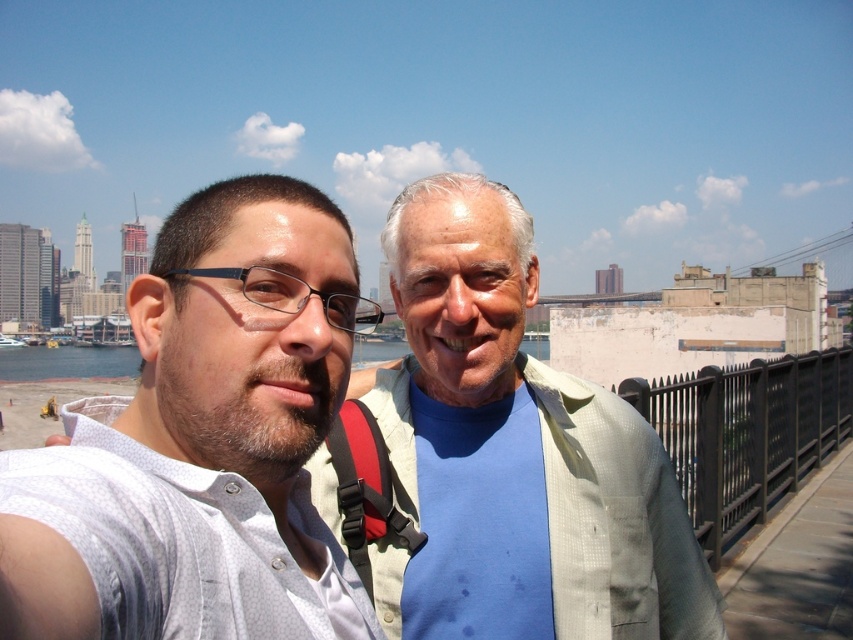
You are a photographer trying to capture a clear photo of both the white textured shirt at center and the light beige shirt at center. Since they are close together, you need to know their arrangement. Which shirt is on the left side when looking at the image?

The white textured shirt at center is positioned on the left side of the light beige shirt at center.

You are a photographer trying to capture a photo of the white textured shirt at center and the clear blue water at center. Since both are in the same scene, can you focus on both objects at the same time?

The white textured shirt at center is in front of clear blue water at center, so focusing on both at the same time may be challenging because the shirt is closer to the camera than the water.

You are a photographer trying to capture a landscape photo of the clear blue water at center and the light beige shirt at center. Since both are in the center, how can you position them to avoid overlapping in your shot?

The light beige shirt at center is to the right of clear blue water at center, so you can position the camera slightly to the left of the light beige shirt at center to ensure both are visible without overlapping.